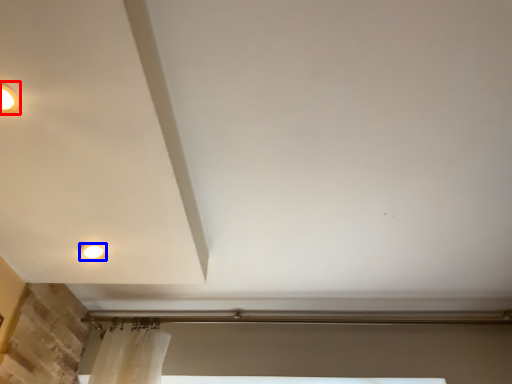
Question: Among these objects, which one is nearest to the camera, lighting (highlighted by a red box) or lamp (highlighted by a blue box)?

Choices:
 (A) lighting
 (B) lamp

Answer: (A)